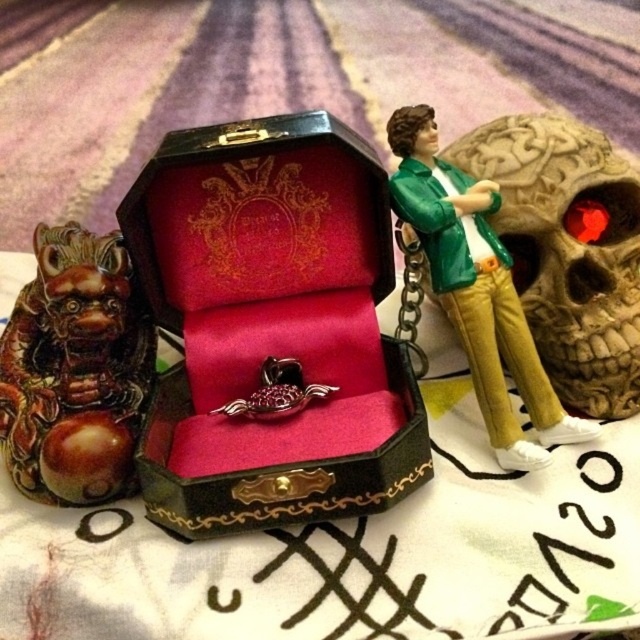
Question: Can you confirm if velvet-lined box at center is positioned above shiny brown statue at left?

Choices:
 (A) yes
 (B) no

Answer: (A)

Question: Among these points, which one is nearest to the camera?

Choices:
 (A) (588, 396)
 (B) (58, 352)
 (C) (211, 365)

Answer: (B)

Question: Is velvet-lined box at center below matte brown skull at right?

Choices:
 (A) yes
 (B) no

Answer: (A)

Question: Which point is closer to the camera?

Choices:
 (A) velvet-lined box at center
 (B) shiny brown statue at left
 (C) matte brown skull at right
 (D) metallic gold chain at center

Answer: (A)

Question: Which object is positioned closest to the metallic gold chain at center?

Choices:
 (A) matte brown skull at right
 (B) velvet-lined box at center
 (C) shiny brown statue at left

Answer: (B)

Question: Does velvet-lined box at center lie in front of matte brown skull at right?

Choices:
 (A) yes
 (B) no

Answer: (A)